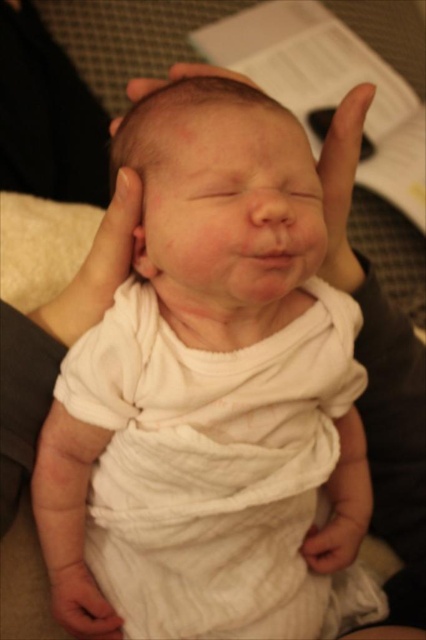
Is white cotton baby at center positioned before white soft cloth at lower center?

Yes.

Is point (45, 442) less distant than point (98, 612)?

That is True.

Identify the location of white cotton baby at center. (210, 385).

Who is higher up, smooth skin head at center or white soft cloth at lower center?

smooth skin head at center is above.

Who is more distant from viewer, (224, 109) or (83, 560)?

The point (83, 560) is more distant.

Locate an element on the screen. Image resolution: width=426 pixels, height=640 pixels. smooth skin head at center is located at coordinates (221, 196).

Does white cotton baby at center have a lesser height compared to smooth skin head at center?

No.

You are a GUI agent. You are given a task and a screenshot of the screen. Output one action in this format:
    pyautogui.click(x=<x>, y=<y>)
    Task: Click on the white cotton baby at center
    
    Given the screenshot: What is the action you would take?
    pyautogui.click(x=210, y=385)

This screenshot has width=426, height=640. In order to click on white cotton baby at center in this screenshot , I will do `click(210, 385)`.